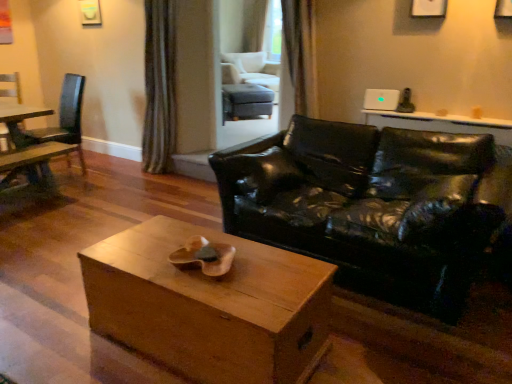
You are a GUI agent. You are given a task and a screenshot of the screen. Output one action in this format:
    pyautogui.click(x=<x>, y=<y>)
    Task: Click on the vacant point above wooden box at center (from a real-world perspective)
    Image resolution: width=512 pixels, height=384 pixels.
    Given the screenshot: What is the action you would take?
    pyautogui.click(x=197, y=272)